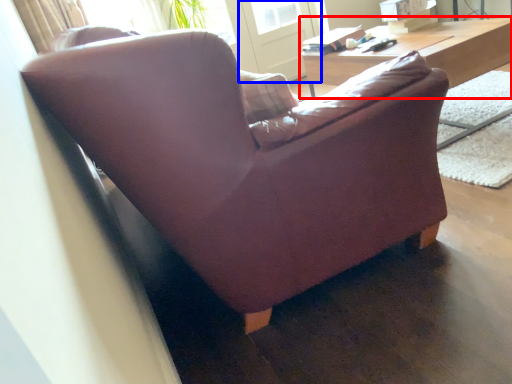
Question: Which point is closer to the camera, table (highlighted by a red box) or screen door (highlighted by a blue box)?

Choices:
 (A) table
 (B) screen door

Answer: (A)